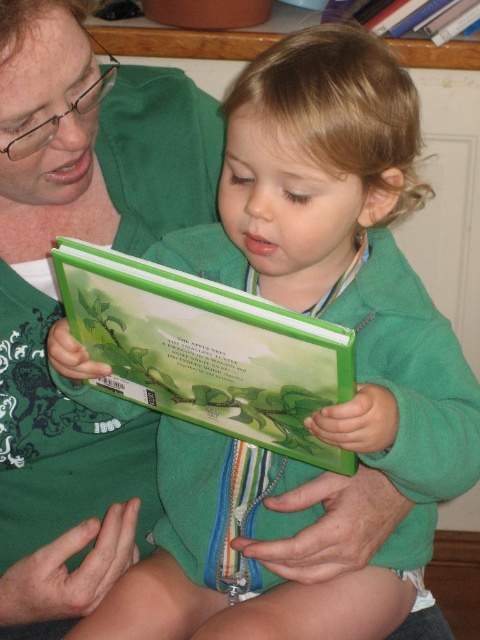
What object is located at the coordinates point (206,349)?

The green matte book at center is located at point (206,349).